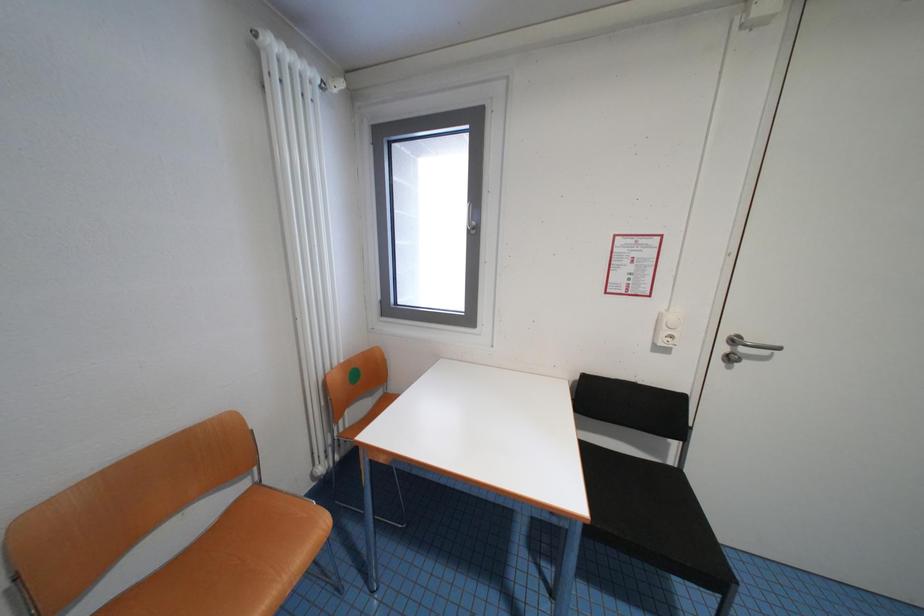
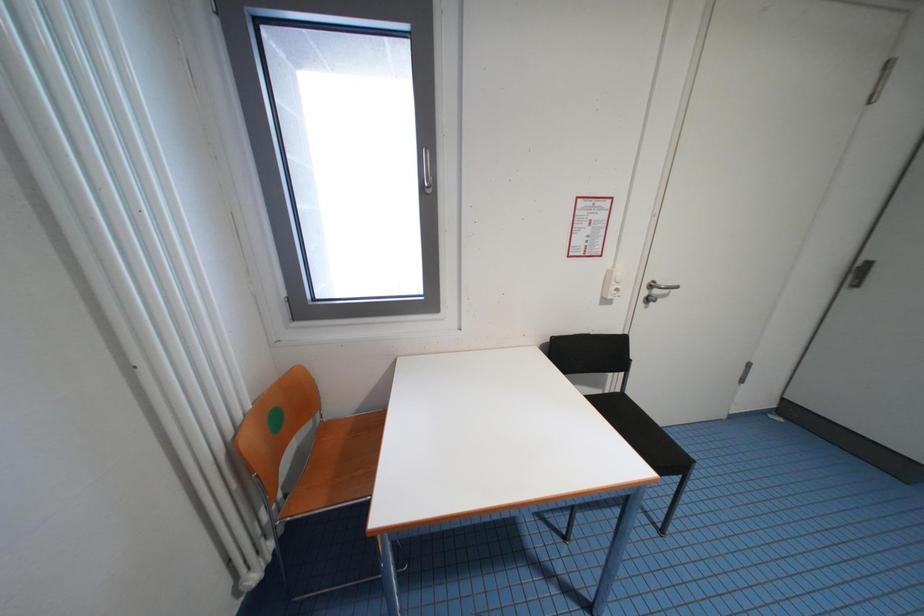
Question: The camera is either moving clockwise (left) or counter-clockwise (right) around the object. The first image is from the beginning of the video and the second image is from the end. Is the camera moving left or right when shooting the video?

Choices:
 (A) Left
 (B) Right

Answer: (A)